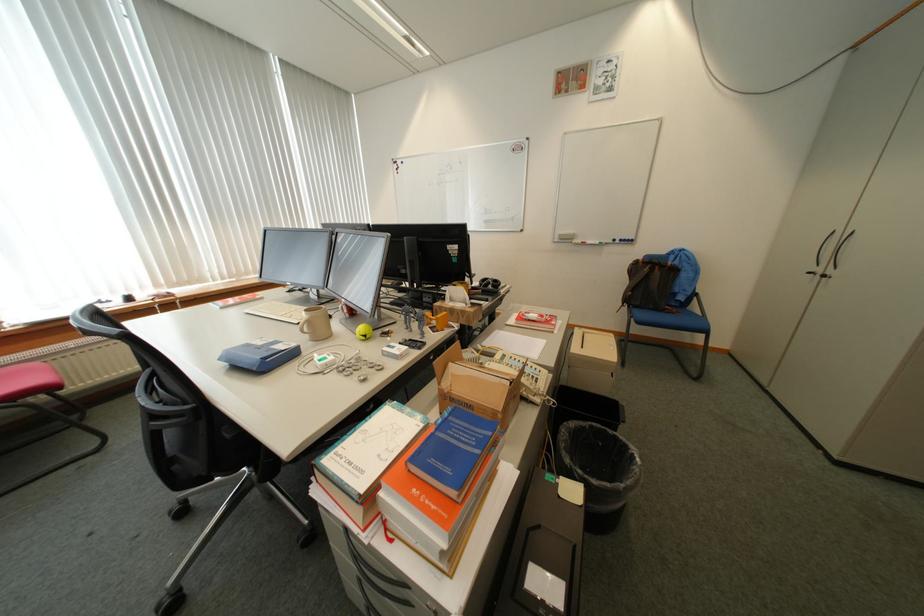
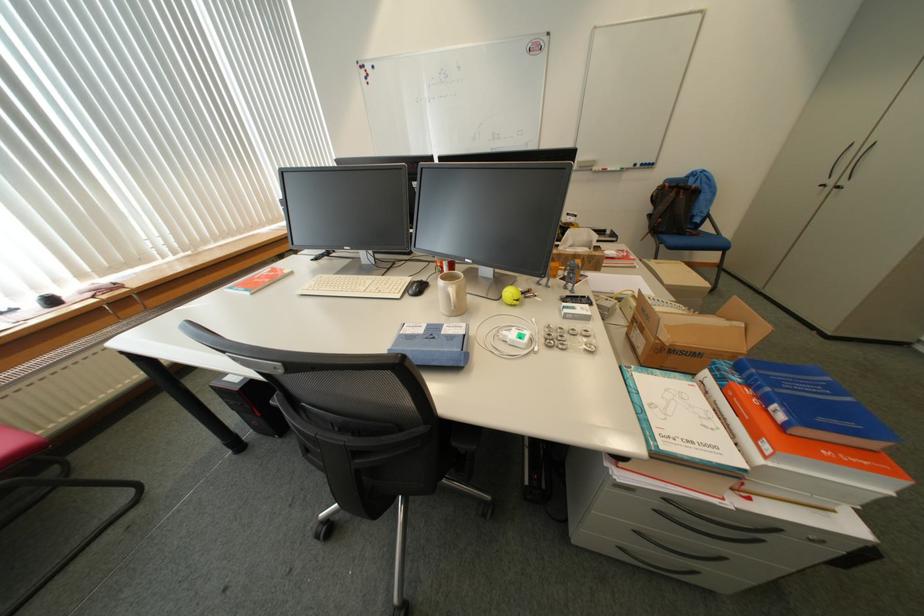
Where in the second image is the point corresponding to (270,344) from the first image?

(430, 331)